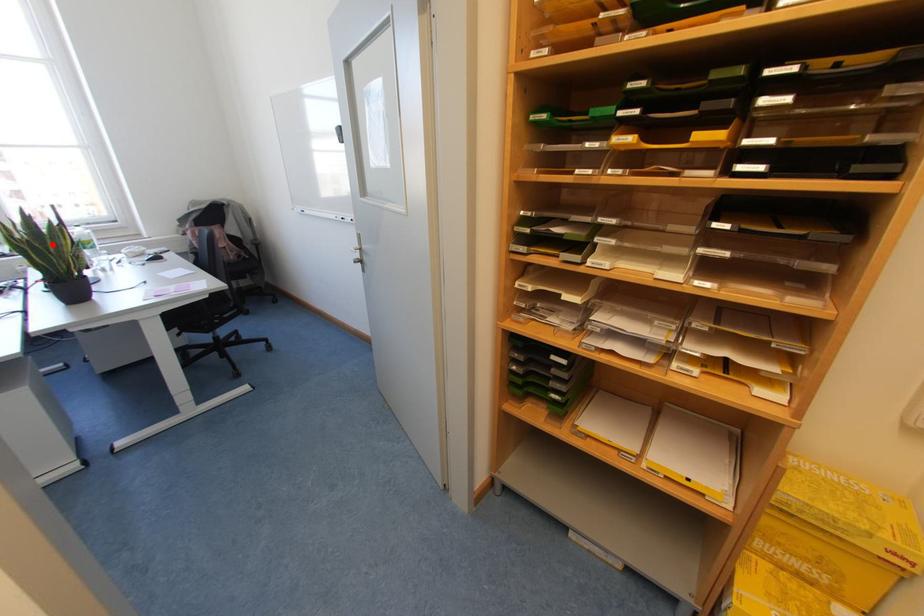
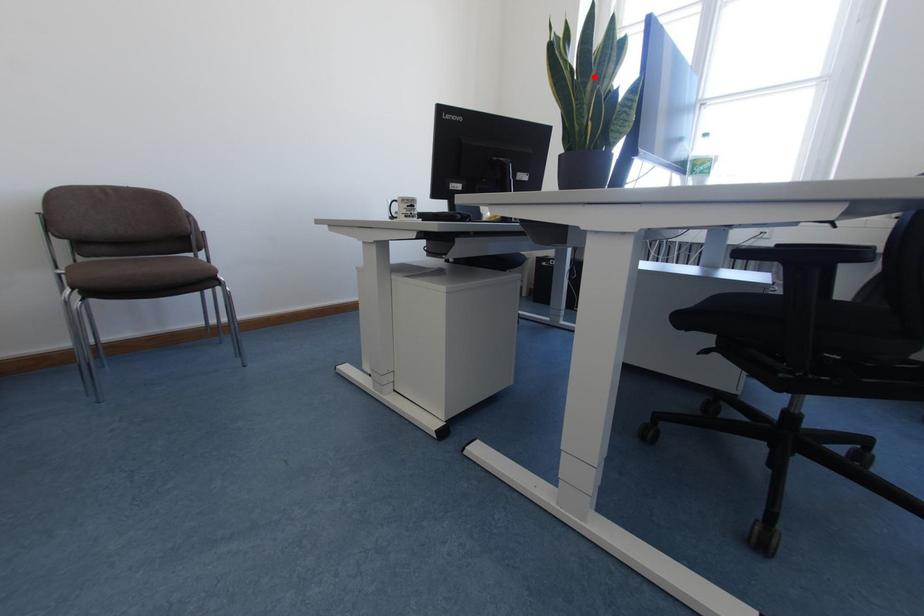
In the scene shown: I am providing you with two images of the same scene from different viewpoints. A red point is marked on the first image and another point is marked on the second image. Are the points marked in image1 and image2 representing the same 3D position?

Yes